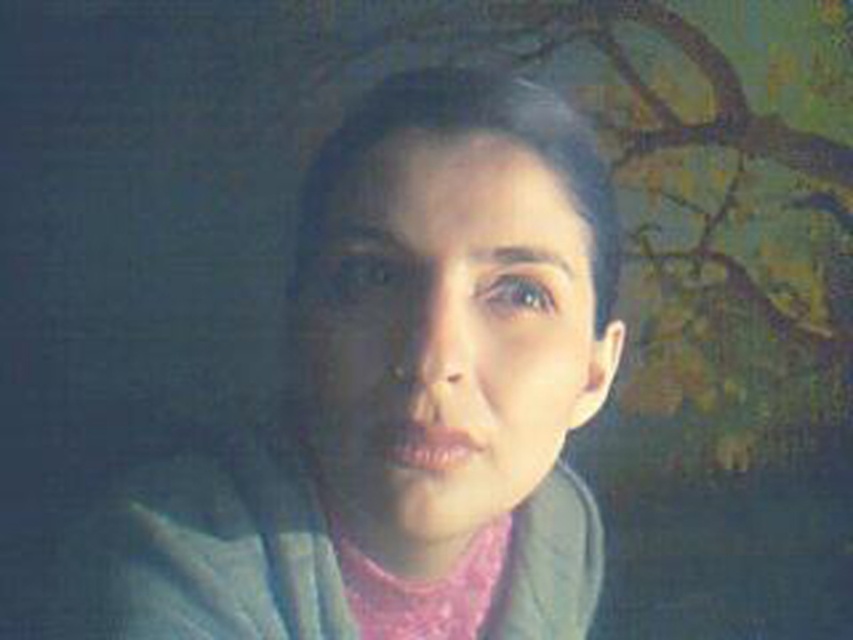
You are a fashion stylist preparing for a photoshoot. You have a matte blue jacket at center and a pink satin scarf at center. The client wants to ensure that the jacket remains the focal point. Based on their sizes, which item should you position higher in the frame to achieve this?

The matte blue jacket at center has a greater height compared to the pink satin scarf at center, so positioning the matte blue jacket at center higher in the frame will naturally draw attention to it as the focal point due to its larger size.

You are taking a photo of a person wearing a matte blue jacket at center and a pink satin scarf at center. You want to focus on the object that is closer to you. Which one should you choose?

The matte blue jacket at center is closer to the viewer than the pink satin scarf at center, so you should focus on the matte blue jacket at center.

You are a photographer adjusting the camera focus. You need to ensure that both the matte blue jacket at center and the pink satin scarf at center are in focus. The camera has a depth of field that can cover 4 inches. Can both objects be in focus at the same time?

The matte blue jacket at center and pink satin scarf at center are 3.76 inches apart. Since the camera has a depth of field of 4 inches, which is slightly larger than the distance between them, both objects can be in focus simultaneously.